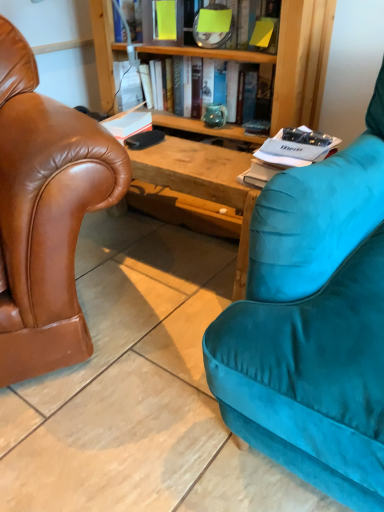
Question: Is matte ceramic vase at center to the right of white paper at right, the first book when ordered from bottom to top, from the viewer's perspective?

Choices:
 (A) no
 (B) yes

Answer: (A)

Question: From a real-world perspective, is matte ceramic vase at center on top of white paper at right, the first book when ordered from bottom to top?

Choices:
 (A) yes
 (B) no

Answer: (B)

Question: Is white paper at right, marked as the 4th book in a top-to-bottom arrangement, a part of matte ceramic vase at center?

Choices:
 (A) yes
 (B) no

Answer: (B)

Question: Does matte ceramic vase at center appear on the left side of white paper at right, marked as the 4th book in a top-to-bottom arrangement?

Choices:
 (A) yes
 (B) no

Answer: (A)

Question: Is matte ceramic vase at center positioned before white paper at right, the first book when ordered from bottom to top?

Choices:
 (A) no
 (B) yes

Answer: (A)

Question: In terms of height, does matte green vase at center, the 3th book when ordered from bottom to top, look taller or shorter compared to matte ceramic vase at center?

Choices:
 (A) short
 (B) tall

Answer: (B)

Question: In terms of width, does matte green vase at center, which is counted as the 2th book, starting from the top, look wider or thinner when compared to matte ceramic vase at center?

Choices:
 (A) thin
 (B) wide

Answer: (B)

Question: Considering the positions of matte green vase at center, which is counted as the 2th book, starting from the top, and matte ceramic vase at center in the image, is matte green vase at center, which is counted as the 2th book, starting from the top, bigger or smaller than matte ceramic vase at center?

Choices:
 (A) small
 (B) big

Answer: (B)

Question: Is point (266, 59) closer or farther from the camera than point (216, 125)?

Choices:
 (A) farther
 (B) closer

Answer: (B)

Question: Considering the positions of white matte book at center, the 2th book when ordered from bottom to top, and yellow paper at upper center, which is the first book in top-to-bottom order, in the image, is white matte book at center, the 2th book when ordered from bottom to top, taller or shorter than yellow paper at upper center, which is the first book in top-to-bottom order,?

Choices:
 (A) tall
 (B) short

Answer: (B)

Question: Based on their positions, is white matte book at center, which appears as the 3th book when viewed from the top, located to the left or right of yellow paper at upper center, which is the first book in top-to-bottom order?

Choices:
 (A) left
 (B) right

Answer: (A)

Question: Considering the positions of point (107, 126) and point (226, 41), is point (107, 126) closer or farther from the camera than point (226, 41)?

Choices:
 (A) closer
 (B) farther

Answer: (B)

Question: From a real-world perspective, relative to yellow paper at upper center, the 4th book when ordered from bottom to top, is white matte book at center, which appears as the 3th book when viewed from the top, vertically above or below?

Choices:
 (A) below
 (B) above

Answer: (A)

Question: From the image's perspective, is yellow paper at upper center, the 4th book when ordered from bottom to top, located above or below matte ceramic vase at center?

Choices:
 (A) below
 (B) above

Answer: (B)

Question: Do you think yellow paper at upper center, which is the first book in top-to-bottom order, is within matte ceramic vase at center, or outside of it?

Choices:
 (A) outside
 (B) inside

Answer: (A)